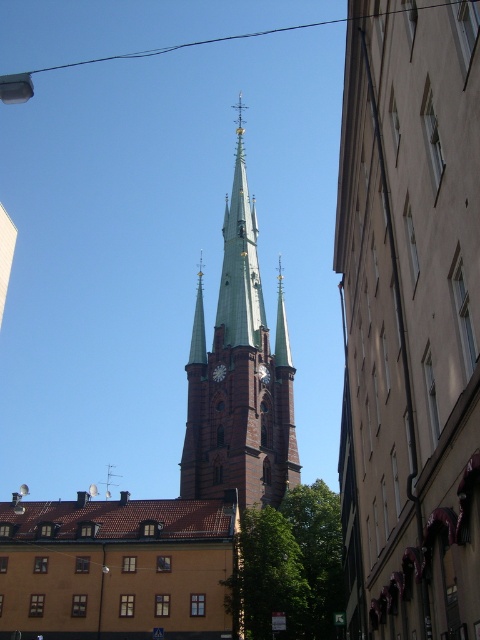
Between point (228, 260) and point (192, 321), which one is positioned behind?

The point (228, 260) is more distant.

Locate an element on the screen. This screenshot has height=640, width=480. green copper spire at center is located at coordinates (240, 260).

This screenshot has height=640, width=480. Find the location of `green copper spire at center`. green copper spire at center is located at coordinates pyautogui.click(x=240, y=260).

Can you confirm if brown brick church steeple at center is wider than brown brick tower at center?

Correct, the width of brown brick church steeple at center exceeds that of brown brick tower at center.

Can you confirm if brown brick church steeple at center is bigger than brown brick tower at center?

Yes.

Does point (207, 625) lie behind point (263, 465)?

No, it is not.

Where is `brown brick church steeple at center`? This screenshot has height=640, width=480. brown brick church steeple at center is located at coordinates (167, 499).

Between green metallic spire at center and white glossy clock at center, which one is positioned higher?

green metallic spire at center

Does green metallic spire at center appear on the left side of white glossy clock at center?

Yes, green metallic spire at center is to the left of white glossy clock at center.

Does point (197, 330) come behind point (223, 374)?

Yes, point (197, 330) is farther from viewer.

You are a GUI agent. You are given a task and a screenshot of the screen. Output one action in this format:
    pyautogui.click(x=<x>, y=<y>)
    Task: Click on the green metallic spire at center
    The image size is (480, 640).
    Given the screenshot: What is the action you would take?
    pyautogui.click(x=197, y=324)